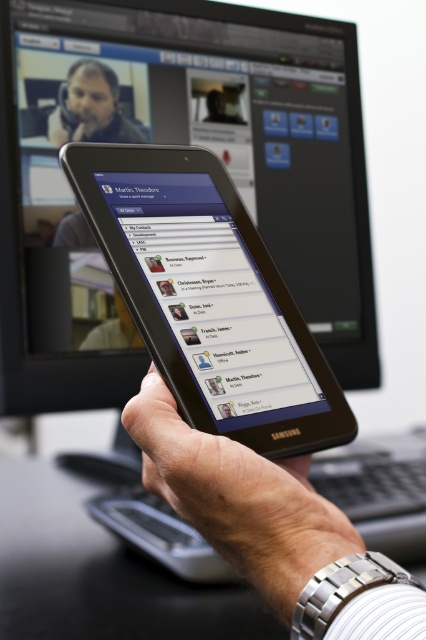
Between black glossy monitor at upper center and black glossy tablet at center, which one is positioned lower?

black glossy tablet at center is below.

Who is shorter, black glossy monitor at upper center or black glossy tablet at center?

With less height is black glossy tablet at center.

Find the location of a particular element. This screenshot has height=640, width=426. black glossy monitor at upper center is located at coordinates (175, 141).

Where is `black glossy monitor at upper center`? This screenshot has width=426, height=640. black glossy monitor at upper center is located at coordinates (175, 141).

Between black glossy monitor at upper center and black matte tablet at center, which one has more height?

With more height is black glossy monitor at upper center.

Locate an element on the screen. The image size is (426, 640). black glossy monitor at upper center is located at coordinates click(175, 141).

Is black glossy tablet at center further to camera compared to black matte tablet at center?

Yes, it is.

Is black glossy tablet at center above black matte tablet at center?

Correct, black glossy tablet at center is located above black matte tablet at center.

Where is `black glossy tablet at center`? Image resolution: width=426 pixels, height=640 pixels. black glossy tablet at center is located at coordinates click(207, 298).